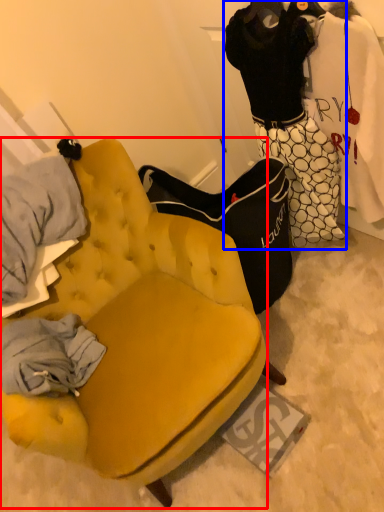
Question: Which of the following is the closest to the observer, chair (highlighted by a red box) or couple (highlighted by a blue box)?

Choices:
 (A) chair
 (B) couple

Answer: (A)